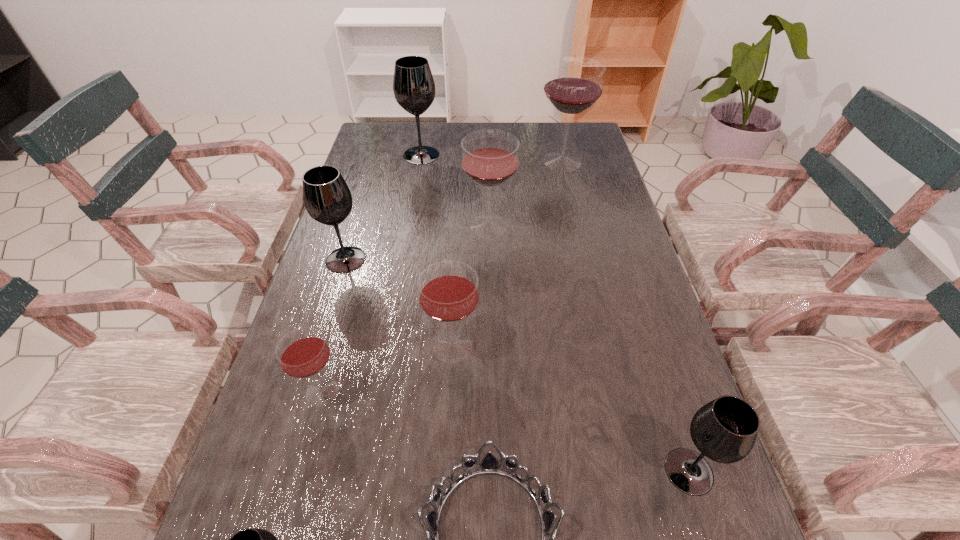
Locate an element on the screen. the seventh farthest wineglass is located at coordinates (724, 430).

Find the location of a particular element. the rightmost gray wineglass is located at coordinates (724, 430).

At what (x,y) coordinates should I click in order to perform the action: click on the fourth nearest object. Please return your answer as a coordinate pair (x, y). This screenshot has width=960, height=540. Looking at the image, I should click on (303, 352).

Find the location of `the nearest red wineglass`. the nearest red wineglass is located at coordinates (303, 352).

I want to click on blank space located 0.370m on the front of the biggest red wineglass, so click(x=585, y=255).

I want to click on free location located 0.400m on the front of the fourth object from left to right, so click(x=405, y=247).

This screenshot has width=960, height=540. I want to click on free space located 0.140m on the front of the fourth farthest wineglass, so click(x=328, y=318).

This screenshot has height=540, width=960. I want to click on free space located 0.070m on the back of the third farthest wineglass, so click(x=488, y=196).

This screenshot has width=960, height=540. What are the coordinates of `free space located on the right of the second nearest red wineglass` in the screenshot? It's located at (660, 347).

Where is `vacant point located 0.230m on the back of the second nearest gray wineglass`? The width and height of the screenshot is (960, 540). vacant point located 0.230m on the back of the second nearest gray wineglass is located at coordinates (x=648, y=343).